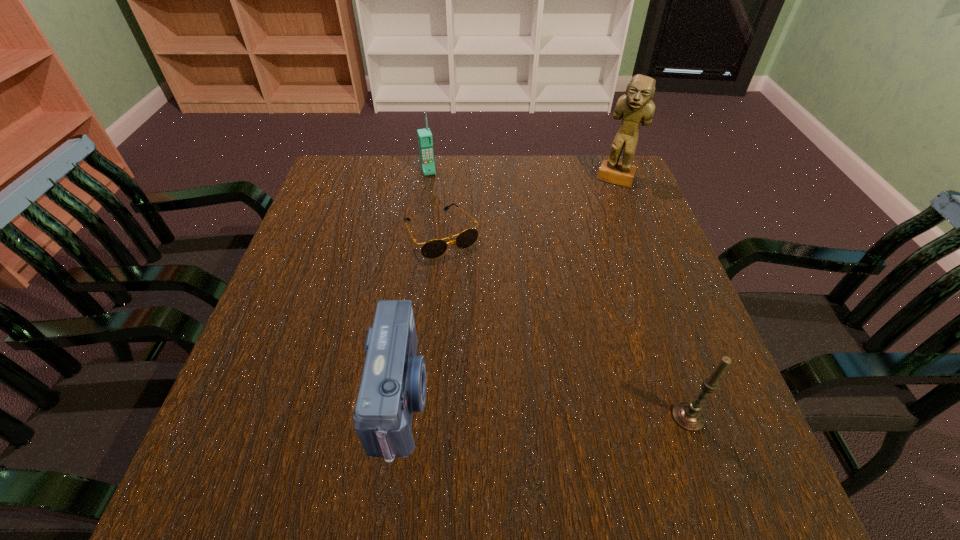
Identify the location of free space at the near left corner of the desktop. The height and width of the screenshot is (540, 960). (310, 429).

This screenshot has width=960, height=540. In order to click on vacant space at the near right corner in this screenshot , I will do `click(748, 438)`.

Where is `free space between the fourth tallest object and the candle`? Image resolution: width=960 pixels, height=540 pixels. free space between the fourth tallest object and the candle is located at coordinates (544, 407).

Find the location of `empty location between the cellular telephone and the fourth tallest object`. empty location between the cellular telephone and the fourth tallest object is located at coordinates (415, 284).

Locate an element on the screen. The image size is (960, 540). vacant space that's between the second shortest object and the cellular telephone is located at coordinates (415, 284).

The height and width of the screenshot is (540, 960). I want to click on blank region between the cellular telephone and the second shortest object, so tap(415, 284).

Locate an element on the screen. This screenshot has width=960, height=540. free space between the cellular telephone and the candle is located at coordinates (558, 294).

This screenshot has width=960, height=540. What are the coordinates of `vacant space in between the third nearest object and the cellular telephone` in the screenshot? It's located at (435, 202).

You are a GUI agent. You are given a task and a screenshot of the screen. Output one action in this format:
    pyautogui.click(x=<x>, y=<y>)
    Task: Click on the vacant area that lies between the sunglasses and the fourth tallest object
    
    Given the screenshot: What is the action you would take?
    pyautogui.click(x=421, y=316)

Where is `vacant area that lies between the cellular telephone and the third farthest object`? This screenshot has height=540, width=960. vacant area that lies between the cellular telephone and the third farthest object is located at coordinates (435, 202).